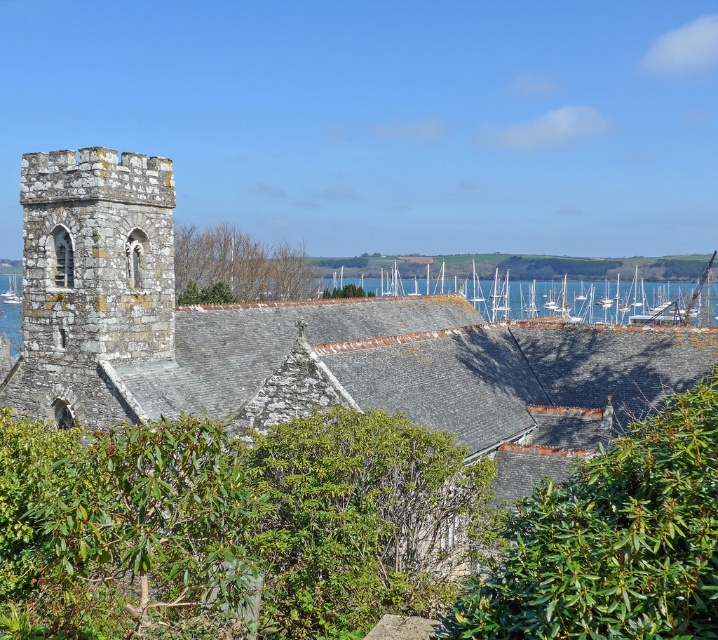
Between stone tower at left and white wooden boats at center, which one is positioned lower?

Positioned lower is stone tower at left.

Is stone tower at left bigger than white wooden boats at center?

No.

What do you see at coordinates (90, 282) in the screenshot? I see `stone tower at left` at bounding box center [90, 282].

Where is `stone tower at left`? The height and width of the screenshot is (640, 718). stone tower at left is located at coordinates (90, 282).

Is stone tower at left above bare branches at upper center?

No.

Is stone tower at left to the right of bare branches at upper center from the viewer's perspective?

Yes, stone tower at left is to the right of bare branches at upper center.

Locate an element on the screen. stone tower at left is located at coordinates (90, 282).

Is green leafy bush at center thinner than white wooden boats at center?

Correct, green leafy bush at center's width is less than white wooden boats at center's.

Who is more forward, (569, 604) or (325, 280)?

Point (569, 604)

Who is more distant from viewer, (617, 625) or (556, 305)?

Point (556, 305)

Identify the location of green leafy bush at center. (610, 540).